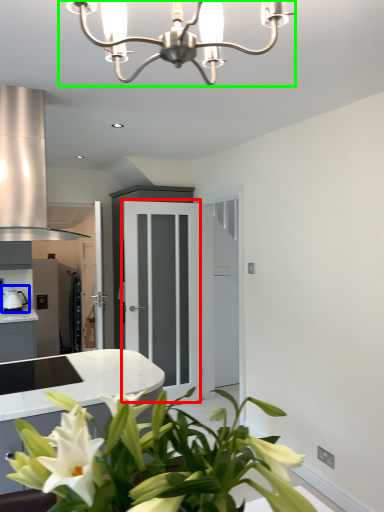
Question: Based on their relative distances, which object is farther from glass door (highlighted by a red box)? Choose from appliance (highlighted by a blue box) and lamp (highlighted by a green box).

Choices:
 (A) appliance
 (B) lamp

Answer: (B)